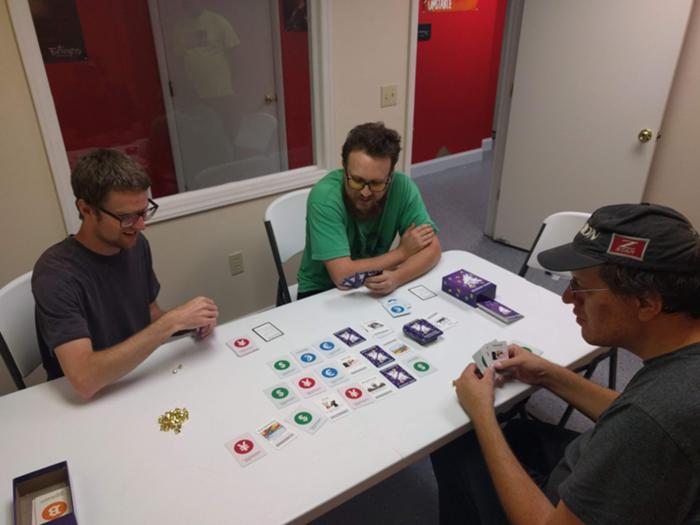
Where is `white wall`? The width and height of the screenshot is (700, 525). white wall is located at coordinates (346, 75).